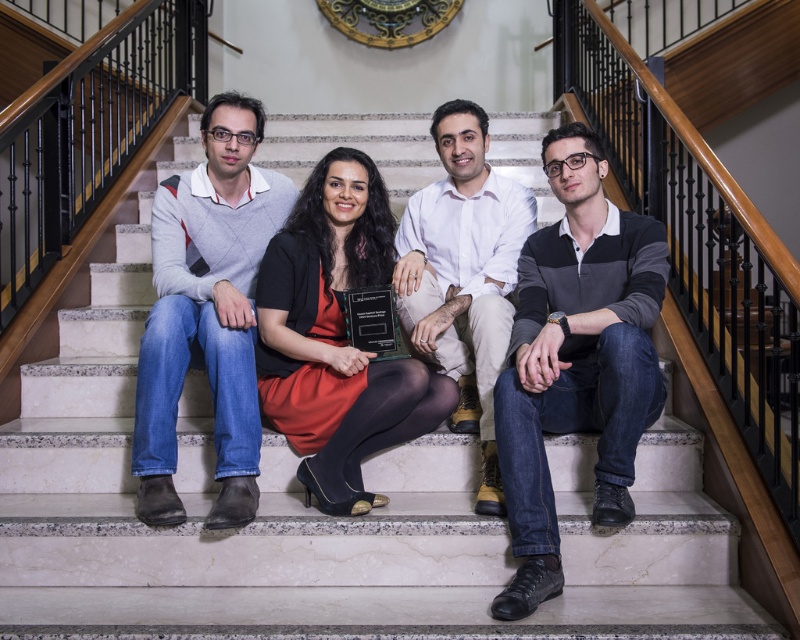
Question: Among these points, which one is farthest from the camera?

Choices:
 (A) (596, 340)
 (B) (320, 184)
 (C) (250, 445)
 (D) (500, 202)

Answer: (D)

Question: Can you confirm if matte gray sweater at left is wider than matte black award at center?

Choices:
 (A) yes
 (B) no

Answer: (B)

Question: Is dark gray knit sweater at center to the right of matte gray sweater at left from the viewer's perspective?

Choices:
 (A) yes
 (B) no

Answer: (A)

Question: Which of the following is the farthest from the observer?

Choices:
 (A) (610, 385)
 (B) (278, 253)

Answer: (B)

Question: Can you confirm if matte black award at center is positioned below white cotton shirt at center?

Choices:
 (A) no
 (B) yes

Answer: (B)

Question: Which of these objects is positioned farthest from the white cotton shirt at center?

Choices:
 (A) matte black award at center
 (B) dark gray knit sweater at center
 (C) matte gray sweater at left

Answer: (C)